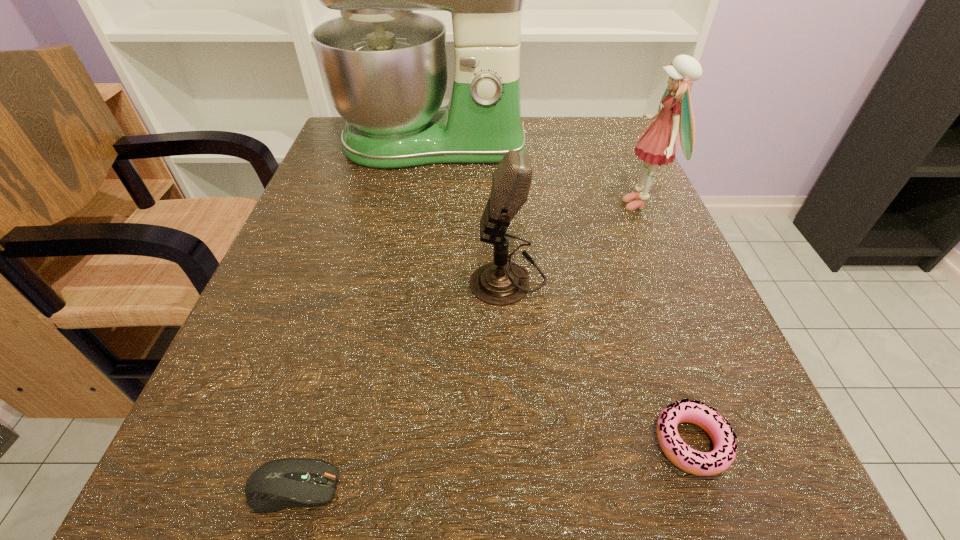
This screenshot has height=540, width=960. I want to click on free space at the right edge, so click(631, 401).

At what (x,y) coordinates should I click in order to perform the action: click on vacant region at the far left corner of the desktop. Please return your answer as a coordinate pair (x, y). This screenshot has height=540, width=960. Looking at the image, I should click on (365, 171).

In the image, there is a desktop. At what (x,y) coordinates should I click in order to perform the action: click on free space at the far right corner. Please return your answer as a coordinate pair (x, y). The width and height of the screenshot is (960, 540). Looking at the image, I should click on (577, 130).

You are a GUI agent. You are given a task and a screenshot of the screen. Output one action in this format:
    pyautogui.click(x=<x>, y=<y>)
    Task: Click on the vacant area that lies between the third nearest object and the computer equipment
    
    Given the screenshot: What is the action you would take?
    pyautogui.click(x=400, y=383)

Find the location of a particular element. The height and width of the screenshot is (540, 960). empty space that is in between the mixer and the doughnut is located at coordinates (562, 293).

Where is `free point between the doughnut and the doll`? The width and height of the screenshot is (960, 540). free point between the doughnut and the doll is located at coordinates (665, 323).

I want to click on free area in between the doll and the farthest object, so click(x=537, y=174).

The height and width of the screenshot is (540, 960). I want to click on unoccupied position between the doughnut and the second farthest object, so click(x=665, y=323).

The height and width of the screenshot is (540, 960). I want to click on empty space between the doughnut and the third shortest object, so click(x=600, y=360).

Where is `free area in between the mixer and the third nearest object`? This screenshot has width=960, height=540. free area in between the mixer and the third nearest object is located at coordinates (470, 211).